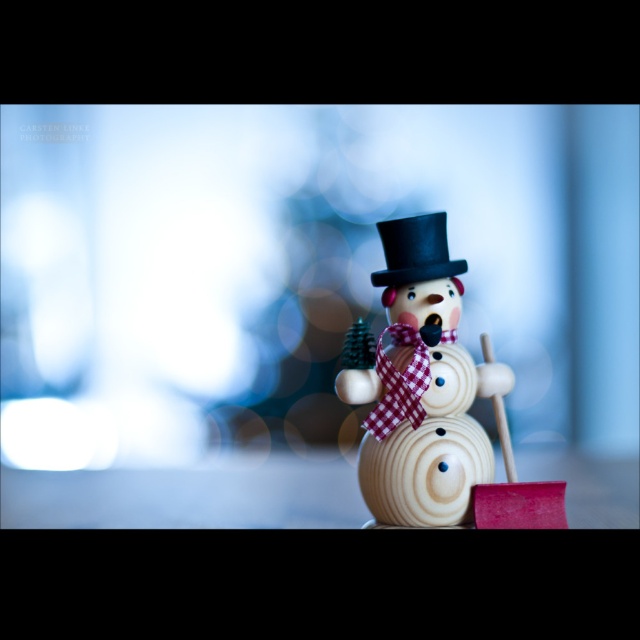
You are an observer standing in front of the snowman scene. You see the wooden snowman at center and the black felt top hat at center. Which object is positioned more to the left?

The black felt top hat at center is positioned more to the left than the wooden snowman at center.

You are standing 3.39 feet away from the wooden snowman at center. If you want to take a photo of it, will you be able to capture the entire snowman in the frame without moving closer or farther?

The wooden snowman at center is 3.39 feet away from the camera. Since the distance matches the required focal length for capturing the entire subject, you can take the photo without moving closer or farther.

You are a winter festival organizer and need to place a decorative snowman and a hat in the main square. The snowman must be placed in a way that it is not obstructed by the hat. Given the current arrangement, is the wooden snowman at center visible from below the black felt top hat at center?

The wooden snowman at center is positioned under the black felt top hat at center, so it is obstructed and not fully visible from below the hat.